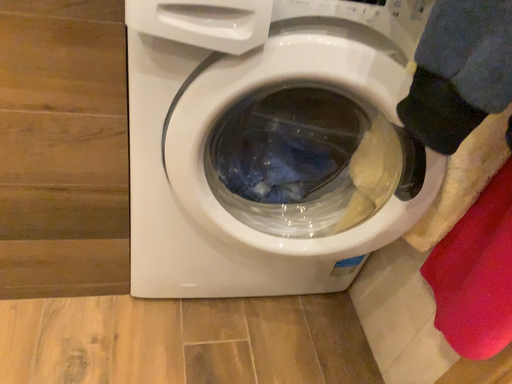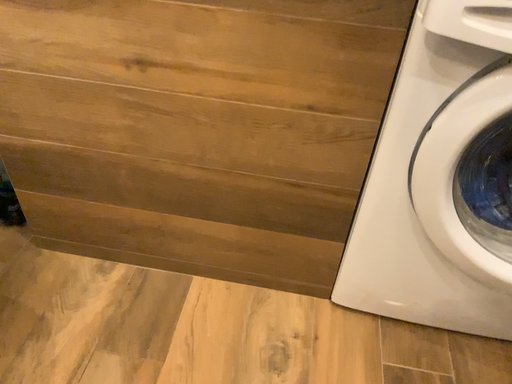
Question: How did the camera likely rotate when shooting the video?

Choices:
 (A) rotated left
 (B) rotated right

Answer: (A)